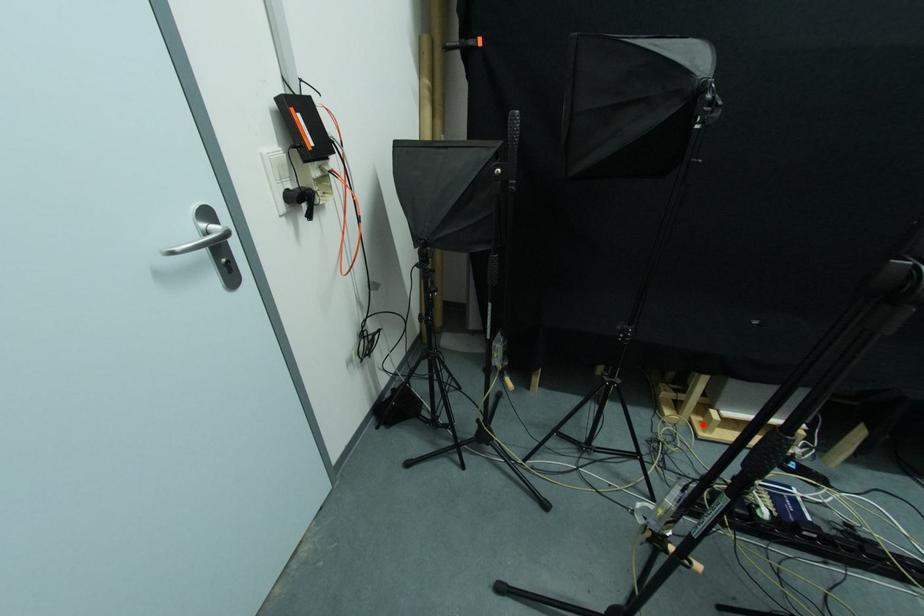
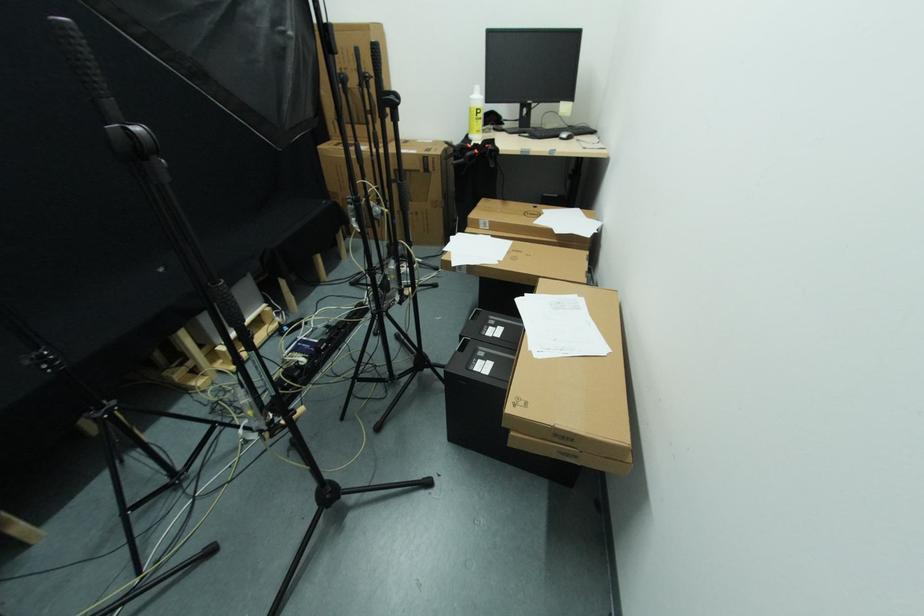
Locate, in the second image, the point that corresponds to the highlighted location in the first image.

(225, 365)